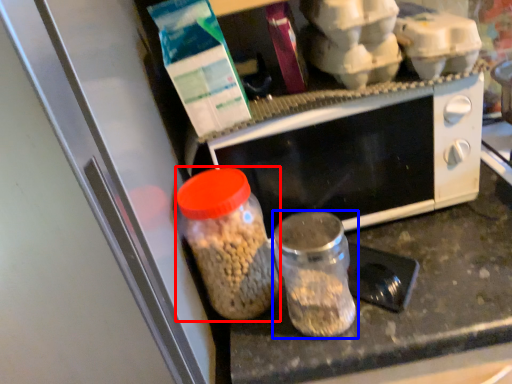
Question: Which object is further to the camera taking this photo, bottle (highlighted by a red box) or bottle (highlighted by a blue box)?

Choices:
 (A) bottle
 (B) bottle

Answer: (A)